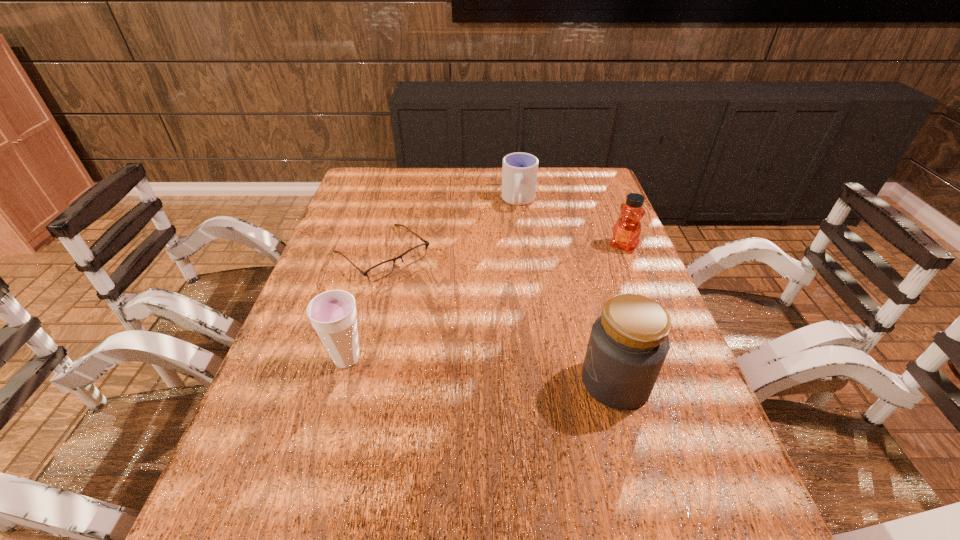
This screenshot has width=960, height=540. Identify the location of free space that satisfies the following two spatial constraints: 1. on the front side of the spectacles; 2. on the surface of the tallest object near the warning symbol. (348, 382).

Locate an element on the screen. vacant space that satisfies the following two spatial constraints: 1. on the front side of the tallest object; 2. on the surface of the farther cup near the warning symbol is located at coordinates (541, 382).

Locate an element on the screen. The image size is (960, 540). free space that satisfies the following two spatial constraints: 1. on the front side of the left cup; 2. on the surface of the tallest object near the warning symbol is located at coordinates (341, 382).